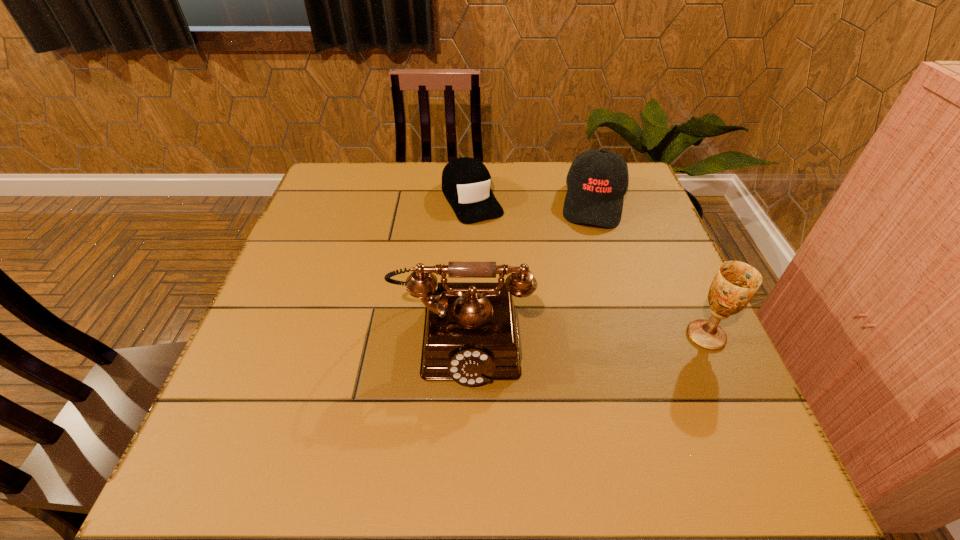
In order to click on the tallest object in this screenshot , I will do `click(470, 336)`.

Where is `the third shortest object`? Image resolution: width=960 pixels, height=540 pixels. the third shortest object is located at coordinates (735, 283).

Locate an element on the screen. Image resolution: width=960 pixels, height=540 pixels. the rightmost object is located at coordinates (735, 283).

The width and height of the screenshot is (960, 540). In order to click on cap in this screenshot , I will do `click(466, 182)`.

Locate an element on the screen. This screenshot has height=540, width=960. the third tallest object is located at coordinates (597, 180).

At what (x,y) coordinates should I click in order to perform the action: click on the third object from left to right. Please return your answer as a coordinate pair (x, y). Looking at the image, I should click on (597, 180).

This screenshot has width=960, height=540. I want to click on blank area located 0.080m on the dial of the tallest object, so click(458, 430).

Locate an element on the screen. free spot located on the back of the third shortest object is located at coordinates (661, 238).

Where is `free location located 0.170m on the front-facing side of the shortest object`? This screenshot has height=540, width=960. free location located 0.170m on the front-facing side of the shortest object is located at coordinates (507, 264).

Locate an element on the screen. Image resolution: width=960 pixels, height=540 pixels. vacant space located on the front-facing side of the shortest object is located at coordinates (492, 239).